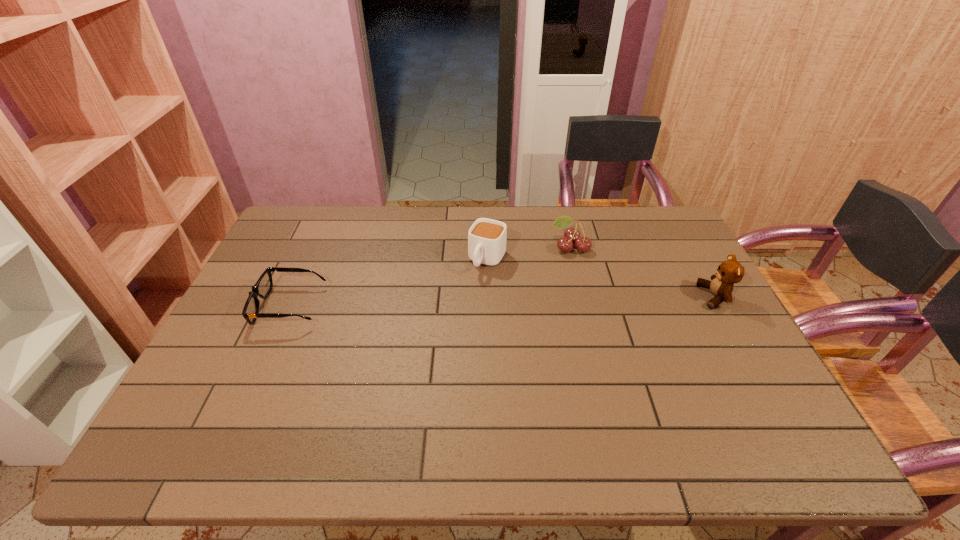
Locate an element on the screen. free location located 0.130m on the leaves of the second object from right to left is located at coordinates (549, 279).

You are a GUI agent. You are given a task and a screenshot of the screen. Output one action in this format:
    pyautogui.click(x=<x>, y=<y>)
    Task: Click on the vacant space situated 0.400m on the leaves of the second object from right to left
    
    Given the screenshot: What is the action you would take?
    pyautogui.click(x=512, y=339)

Locate an element on the screen. The height and width of the screenshot is (540, 960). free space located on the side with the handle of the third object from right to left is located at coordinates (433, 355).

This screenshot has height=540, width=960. I want to click on free location located 0.080m on the side with the handle of the third object from right to left, so tap(470, 292).

The image size is (960, 540). Identify the location of free location located on the side with the handle of the third object from right to left. (465, 301).

The width and height of the screenshot is (960, 540). What are the coordinates of `cherry that is positioned at the far edge` in the screenshot? It's located at (572, 235).

Locate an element on the screen. This screenshot has width=960, height=540. cup that is at the far edge is located at coordinates (487, 238).

Where is `object positioned at the left edge`? Image resolution: width=960 pixels, height=540 pixels. object positioned at the left edge is located at coordinates (262, 288).

This screenshot has height=540, width=960. I want to click on object that is at the right edge, so click(x=730, y=271).

Find the location of a particular element. vacant space at the far edge is located at coordinates (384, 219).